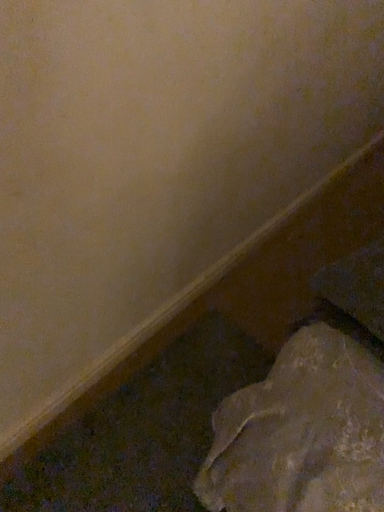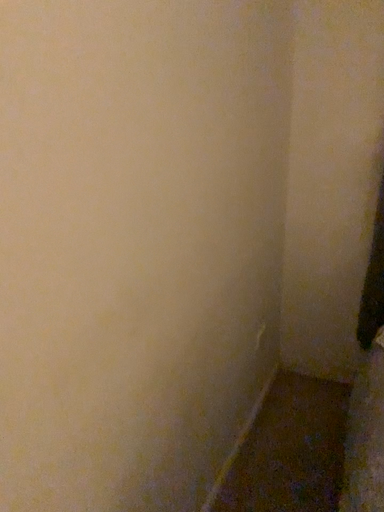
Question: Which way did the camera rotate in the video?

Choices:
 (A) rotated right
 (B) rotated left

Answer: (A)